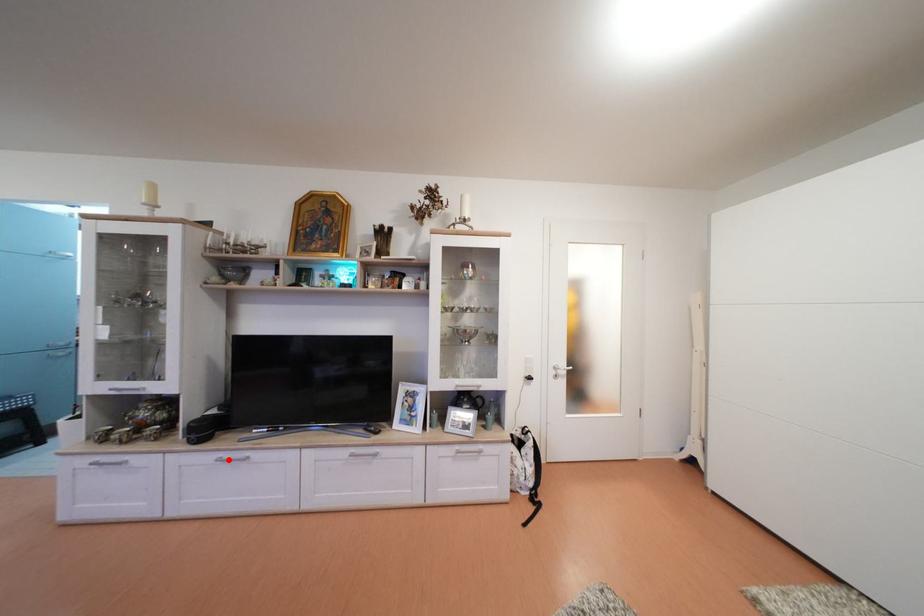
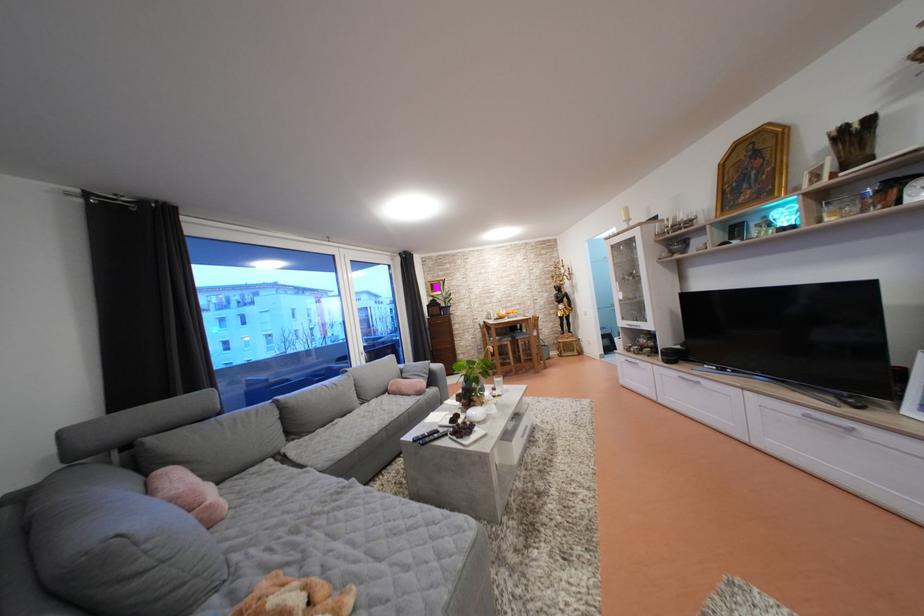
Question: I am providing you with two images of the same scene from different viewpoints. A red point is marked on the first image. Is the red point's position out of view in image 2?

Choices:
 (A) Yes
 (B) No

Answer: (B)